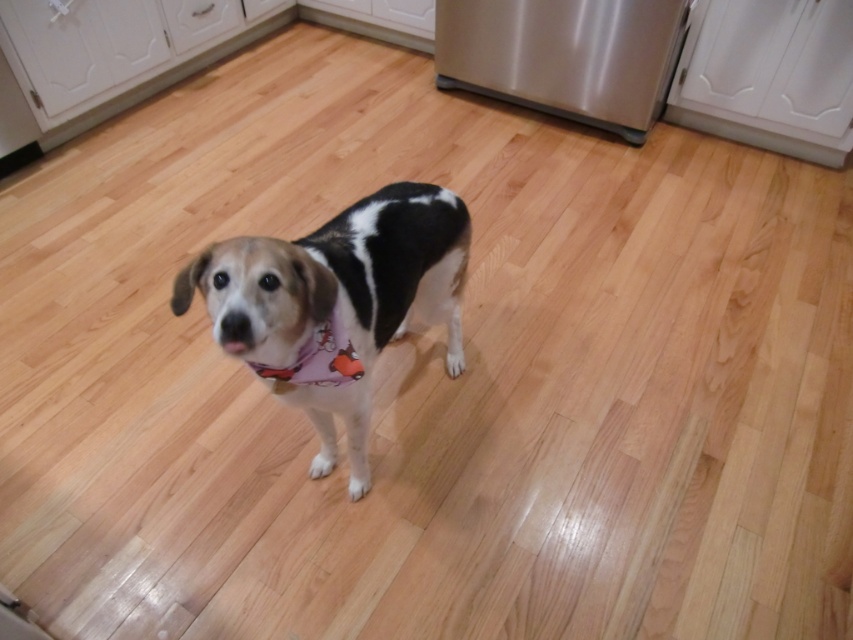
Question: Does stainless steel refrigerator at center appear on the left side of purple fabric neckband at center?

Choices:
 (A) yes
 (B) no

Answer: (B)

Question: Estimate the real-world distances between objects in this image. Which object is farther from the purple fabric neckband at center?

Choices:
 (A) white fur dog at center
 (B) stainless steel refrigerator at center

Answer: (B)

Question: From the image, what is the correct spatial relationship of white fur dog at center in relation to stainless steel refrigerator at center?

Choices:
 (A) left
 (B) right

Answer: (A)

Question: Considering the relative positions of white fur dog at center and stainless steel refrigerator at center in the image provided, where is white fur dog at center located with respect to stainless steel refrigerator at center?

Choices:
 (A) below
 (B) above

Answer: (A)

Question: Among these points, which one is nearest to the camera?

Choices:
 (A) (299, 371)
 (B) (538, 72)
 (C) (434, 211)

Answer: (A)

Question: Which point appears farthest from the camera in this image?

Choices:
 (A) (616, 100)
 (B) (306, 406)
 (C) (329, 326)

Answer: (A)